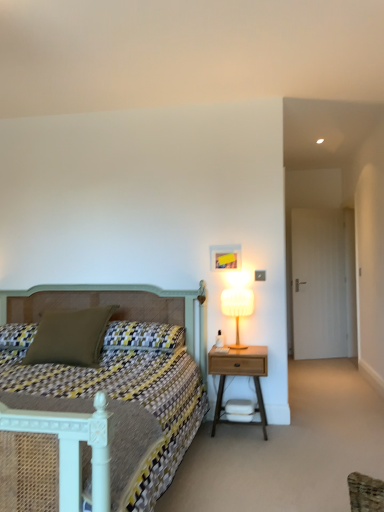
Question: Is the surface of white fabric lampshade at right in direct contact with textured olive green pillow at center-left, positioned as the 1th pillow in right-to-left order?

Choices:
 (A) yes
 (B) no

Answer: (B)

Question: Is white fabric lampshade at right aimed at textured olive green pillow at center-left, which appears as the 2th pillow when viewed from the left?

Choices:
 (A) yes
 (B) no

Answer: (B)

Question: From the image's perspective, is white fabric lampshade at right under textured olive green pillow at center-left, which appears as the 2th pillow when viewed from the left?

Choices:
 (A) yes
 (B) no

Answer: (B)

Question: Is white fabric lampshade at right not inside textured olive green pillow at center-left, which appears as the 2th pillow when viewed from the left?

Choices:
 (A) yes
 (B) no

Answer: (A)

Question: From the image's perspective, is white fabric lampshade at right above textured olive green pillow at center-left, which appears as the 2th pillow when viewed from the left?

Choices:
 (A) yes
 (B) no

Answer: (A)

Question: Is textured olive green pillow at center-left, which appears as the 2th pillow when viewed from the left, situated inside matte green pillow at left, the second pillow positioned from the right, or outside?

Choices:
 (A) inside
 (B) outside

Answer: (B)

Question: Relative to matte green pillow at left, the first pillow positioned from the left, is textured olive green pillow at center-left, which appears as the 2th pillow when viewed from the left, in front or behind?

Choices:
 (A) front
 (B) behind

Answer: (B)

Question: Considering the positions of point (172, 339) and point (56, 316), is point (172, 339) closer or farther from the camera than point (56, 316)?

Choices:
 (A) closer
 (B) farther

Answer: (A)

Question: Considering the positions of textured olive green pillow at center-left, positioned as the 1th pillow in right-to-left order, and matte green pillow at left, the second pillow positioned from the right, in the image, is textured olive green pillow at center-left, positioned as the 1th pillow in right-to-left order, bigger or smaller than matte green pillow at left, the second pillow positioned from the right,?

Choices:
 (A) small
 (B) big

Answer: (A)

Question: Does point (236, 306) appear closer or farther from the camera than point (67, 431)?

Choices:
 (A) farther
 (B) closer

Answer: (A)

Question: Considering their positions, is white fabric lampshade at right located in front of or behind patterned fabric bed at center?

Choices:
 (A) behind
 (B) front

Answer: (A)

Question: Considering the positions of white fabric lampshade at right and patterned fabric bed at center in the image, is white fabric lampshade at right bigger or smaller than patterned fabric bed at center?

Choices:
 (A) big
 (B) small

Answer: (B)

Question: From the image's perspective, is white fabric lampshade at right positioned above or below patterned fabric bed at center?

Choices:
 (A) below
 (B) above

Answer: (B)

Question: Considering the positions of patterned fabric bed at center and textured olive green pillow at center-left, positioned as the 1th pillow in right-to-left order, in the image, is patterned fabric bed at center wider or thinner than textured olive green pillow at center-left, positioned as the 1th pillow in right-to-left order,?

Choices:
 (A) wide
 (B) thin

Answer: (A)

Question: From a real-world perspective, is patterned fabric bed at center above or below textured olive green pillow at center-left, which appears as the 2th pillow when viewed from the left?

Choices:
 (A) below
 (B) above

Answer: (A)